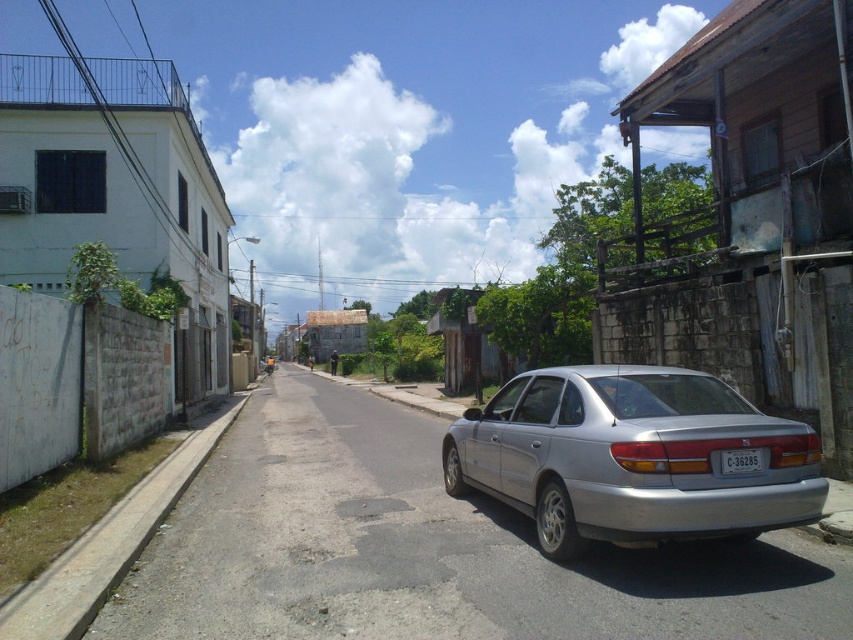
You are a delivery driver who needs to park your truck between the silver metallic car at center and the silver metallic car at right. Can you fit your truck which is 5 meters long into the space between them?

→ The silver metallic car at center is bigger than silver metallic car at right, but the exact distance between them is not provided. Therefore, it is impossible to determine if the truck can fit.

You are a delivery driver who needs to park your van, which is 2 meters wide, on the street. The parking spot you want is between the silver metallic car at center and the low wall with vegetation growing over. Is there enough space for your van?

The silver metallic car at center is located at point (x=425, y=548). Since the exact distance between the car and the low wall isn

You are a delivery person trying to determine if your 1.8 meters tall box can fit in the space between the silver metallic car at center and the white plastic license plate at rear. Can it fit vertically?

The silver metallic car at center is taller than the white plastic license plate at rear. Since the box is 1.8 meters tall, it may not fit vertically if the available space between them is less than 1.8 meters. However, the exact dimensions aren